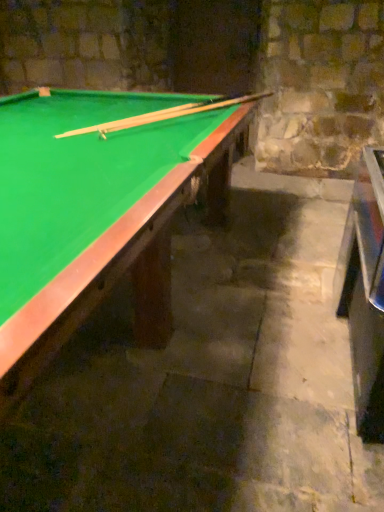
Question: Should I look upward or downward to see wooden cue at upper center?

Choices:
 (A) up
 (B) down

Answer: (A)

Question: From the image's perspective, is metallic silver table at right on top of wooden cue at upper center?

Choices:
 (A) no
 (B) yes

Answer: (A)

Question: Is metallic silver table at right facing away from wooden cue at upper center?

Choices:
 (A) yes
 (B) no

Answer: (B)

Question: Can you confirm if metallic silver table at right is wider than wooden cue at upper center?

Choices:
 (A) no
 (B) yes

Answer: (A)

Question: Is metallic silver table at right taller than wooden cue at upper center?

Choices:
 (A) yes
 (B) no

Answer: (A)

Question: From a real-world perspective, is metallic silver table at right beneath wooden cue at upper center?

Choices:
 (A) no
 (B) yes

Answer: (B)

Question: Considering the relative positions of metallic silver table at right and wooden cue at upper center in the image provided, is metallic silver table at right to the right of wooden cue at upper center from the viewer's perspective?

Choices:
 (A) yes
 (B) no

Answer: (A)

Question: Is wooden cue at upper center completely or partially outside of green felt billiard table at upper left?

Choices:
 (A) yes
 (B) no

Answer: (B)

Question: Considering the relative sizes of wooden cue at upper center and green felt billiard table at upper left in the image provided, is wooden cue at upper center bigger than green felt billiard table at upper left?

Choices:
 (A) yes
 (B) no

Answer: (B)

Question: Considering the relative positions of wooden cue at upper center and green felt billiard table at upper left in the image provided, is wooden cue at upper center to the right of green felt billiard table at upper left from the viewer's perspective?

Choices:
 (A) no
 (B) yes

Answer: (B)

Question: From the image's perspective, is wooden cue at upper center over green felt billiard table at upper left?

Choices:
 (A) no
 (B) yes

Answer: (B)

Question: Does wooden cue at upper center come in front of green felt billiard table at upper left?

Choices:
 (A) yes
 (B) no

Answer: (B)

Question: Is wooden cue at upper center turned away from green felt billiard table at upper left?

Choices:
 (A) yes
 (B) no

Answer: (A)

Question: Is green felt billiard table at upper left in front of wooden cue at upper center?

Choices:
 (A) yes
 (B) no

Answer: (A)